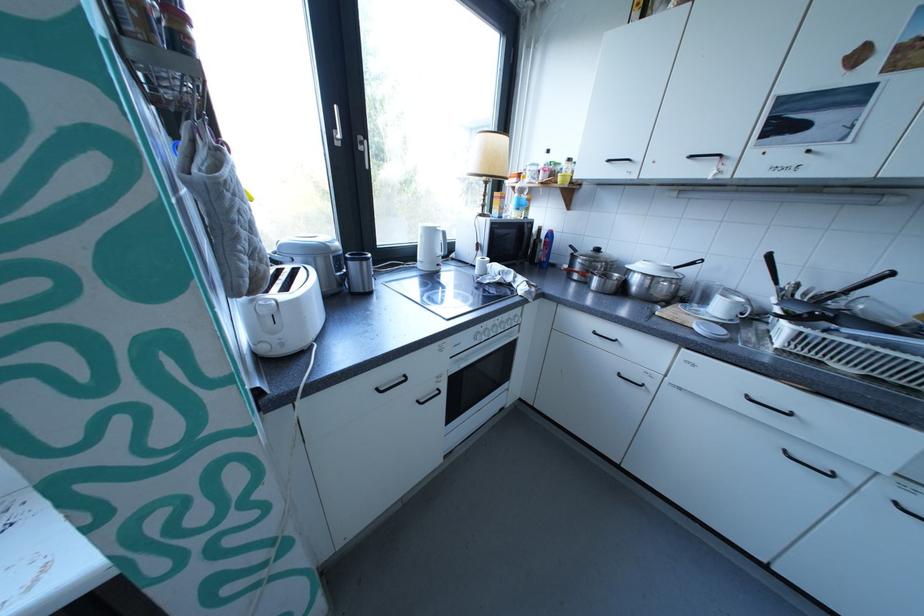
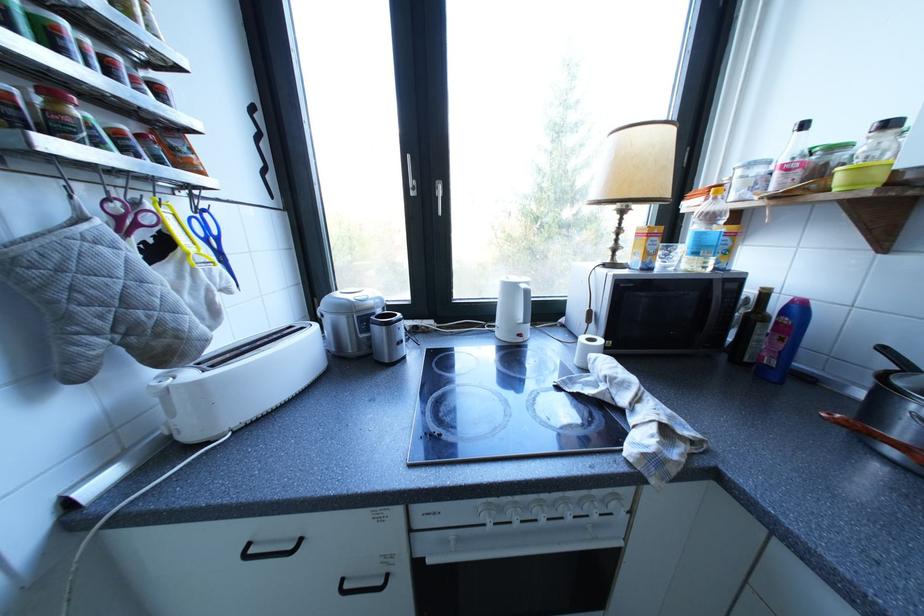
Question: Based on the continuous images, in which direction is the camera rotating? Reply with the corresponding letter.

Choices:
 (A) Left
 (B) Right
 (C) Up
 (D) Down

Answer: (A)